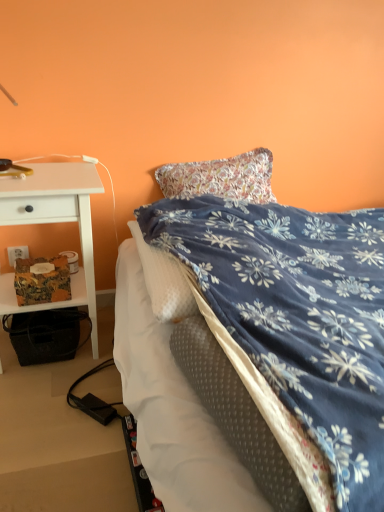
The image size is (384, 512). What do you see at coordinates (17, 254) in the screenshot?
I see `white plastic power outlet at lower left` at bounding box center [17, 254].

Find the location of `white wood desk at left`. white wood desk at left is located at coordinates (54, 222).

Image resolution: width=384 pixels, height=512 pixels. In order to click on blue floral blanket at center in this screenshot , I will do `click(282, 312)`.

Image resolution: width=384 pixels, height=512 pixels. I want to click on white plastic power outlet at lower left, so click(x=17, y=254).

From the image's perspective, does white plastic power outlet at lower left appear higher than blue floral blanket at center?

Yes, from the image's perspective, white plastic power outlet at lower left is above blue floral blanket at center.

Is white plastic power outlet at lower left looking in the opposite direction of blue floral blanket at center?

No, white plastic power outlet at lower left's orientation is not away from blue floral blanket at center.

Between white plastic power outlet at lower left and blue floral blanket at center, which one appears on the right side from the viewer's perspective?

blue floral blanket at center.

Looking at this image, from a real-world perspective, does blue floral blanket at center sit lower than white plastic power outlet at lower left?

No, from a real-world perspective, blue floral blanket at center is not below white plastic power outlet at lower left.

Is blue floral blanket at center oriented towards white plastic power outlet at lower left?

No, blue floral blanket at center is not oriented towards white plastic power outlet at lower left.

Is blue floral blanket at center taller or shorter than white plastic power outlet at lower left?

In the image, blue floral blanket at center appears to be taller than white plastic power outlet at lower left.

In the image, there is a blue floral blanket at center. Where is `power outlet below it (from a real-world perspective)`? power outlet below it (from a real-world perspective) is located at coordinates (17, 254).

Are white wood desk at left and blue floral blanket at center far apart?

No, white wood desk at left is not far away from blue floral blanket at center.

Where is `bed below the white wood desk at left (from a real-world perspective)`? The height and width of the screenshot is (512, 384). bed below the white wood desk at left (from a real-world perspective) is located at coordinates (282, 312).

Would you say white wood desk at left contains blue floral blanket at center?

No, blue floral blanket at center is not surrounded by white wood desk at left.

Relative to blue floral blanket at center, is white wood desk at left in front or behind?

In the image, white wood desk at left appears behind blue floral blanket at center.

Is blue floral blanket at center shorter than white wood desk at left?

Yes.

Between blue floral blanket at center and white wood desk at left, which one has smaller size?

Smaller between the two is white wood desk at left.

Considering the sizes of objects blue floral blanket at center and white wood desk at left in the image provided, who is wider, blue floral blanket at center or white wood desk at left?

blue floral blanket at center is wider.

Which object is closer to the camera, blue floral blanket at center or white wood desk at left?

Positioned in front is blue floral blanket at center.

Does white plastic power outlet at lower left come behind white wood desk at left?

Yes, it is.

Does white plastic power outlet at lower left appear on the left side of white wood desk at left?

Indeed, white plastic power outlet at lower left is positioned on the left side of white wood desk at left.

From their relative heights in the image, would you say white plastic power outlet at lower left is taller or shorter than white wood desk at left?

Considering their sizes, white plastic power outlet at lower left has less height than white wood desk at left.

Is white plastic power outlet at lower left touching white wood desk at left?

white plastic power outlet at lower left and white wood desk at left are clearly separated.

Can white plastic power outlet at lower left be found inside white wood desk at left?

No, white plastic power outlet at lower left is located outside of white wood desk at left.

Based on the photo, which object is more forward, white wood desk at left or white plastic power outlet at lower left?

white wood desk at left is in front.

Can you confirm if white wood desk at left is taller than white plastic power outlet at lower left?

Correct, white wood desk at left is much taller as white plastic power outlet at lower left.

Are white wood desk at left and white plastic power outlet at lower left located far from each other?

That's not correct — white wood desk at left is a little close to white plastic power outlet at lower left.

Where is `power outlet that is above the blue floral blanket at center (from the image's perspective)`? power outlet that is above the blue floral blanket at center (from the image's perspective) is located at coordinates (17, 254).

This screenshot has width=384, height=512. Identify the location of power outlet on the left of blue floral blanket at center. (17, 254).

Considering their positions, is white plastic power outlet at lower left positioned further to blue floral blanket at center than white wood desk at left?

Based on the image, white plastic power outlet at lower left appears to be further to blue floral blanket at center.

Based on their spatial positions, is white wood desk at left or white plastic power outlet at lower left closer to blue floral blanket at center?

Among the two, white wood desk at left is located nearer to blue floral blanket at center.

Considering their positions, is blue floral blanket at center positioned closer to white wood desk at left than white plastic power outlet at lower left?

The object closer to white wood desk at left is white plastic power outlet at lower left.

In the scene shown: Estimate the real-world distances between objects in this image. Which object is further from white plastic power outlet at lower left, blue floral blanket at center or white wood desk at left?

blue floral blanket at center.

Which object lies nearer to the anchor point white wood desk at left, white plastic power outlet at lower left or blue floral blanket at center?

white plastic power outlet at lower left.

Considering their positions, is white wood desk at left positioned further to white plastic power outlet at lower left than blue floral blanket at center?

The object further to white plastic power outlet at lower left is blue floral blanket at center.

In order to click on desk situated between white plastic power outlet at lower left and blue floral blanket at center from left to right in this screenshot , I will do `click(54, 222)`.